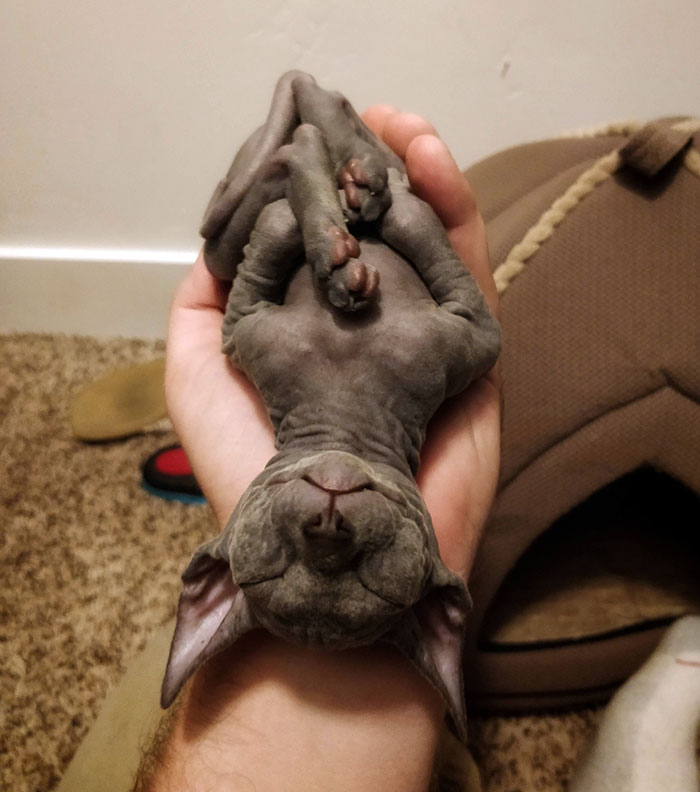
Find the location of a particular element. floor is located at coordinates click(62, 492).